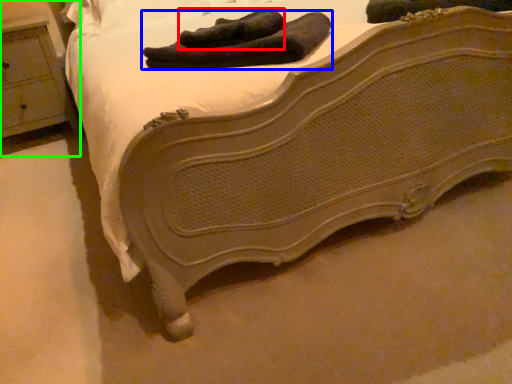
Question: Considering the real-world distances, which object is farthest from footwear (highlighted by a red box)? footwear (highlighted by a blue box) or nightstand (highlighted by a green box)?

Choices:
 (A) footwear
 (B) nightstand

Answer: (B)